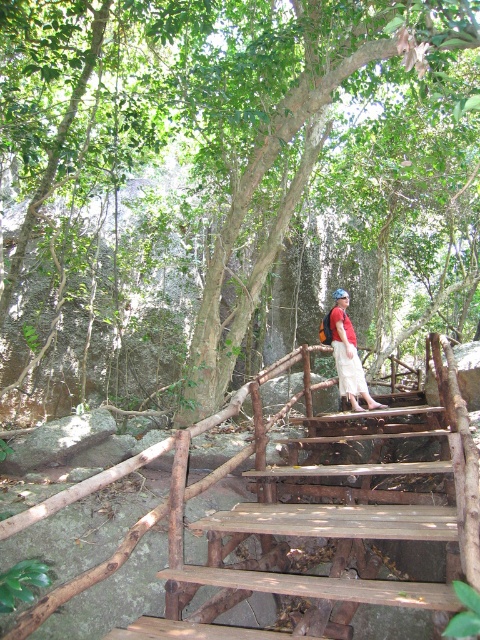
Looking at this image, is green leafy tree at center positioned at the back of rusty wood stairs at center?

Yes, green leafy tree at center is behind rusty wood stairs at center.

Is green leafy tree at center above rusty wood stairs at center?

Yes, green leafy tree at center is above rusty wood stairs at center.

At what (x,y) coordinates should I click in order to perform the action: click on green leafy tree at center. Please return your answer as a coordinate pair (x, y). The image size is (480, 640). Looking at the image, I should click on (230, 172).

Which is below, rusty wood stairs at center or matte red shirt at center?

rusty wood stairs at center

Can you confirm if rusty wood stairs at center is thinner than matte red shirt at center?

No, rusty wood stairs at center is not thinner than matte red shirt at center.

You are a GUI agent. You are given a task and a screenshot of the screen. Output one action in this format:
    pyautogui.click(x=<x>, y=<y>)
    Task: Click on the rusty wood stairs at center
    This screenshot has height=640, width=480.
    Given the screenshot: What is the action you would take?
    pyautogui.click(x=328, y=528)

Can you confirm if green leafy tree at center is positioned to the right of matte red shirt at center?

Incorrect, green leafy tree at center is not on the right side of matte red shirt at center.

Is point (117, 125) less distant than point (348, 397)?

No, (117, 125) is behind (348, 397).

Does point (41, 16) come closer to viewer compared to point (355, 333)?

Yes, point (41, 16) is closer to viewer.

Identify the location of green leafy tree at center. Image resolution: width=480 pixels, height=640 pixels. point(230,172).